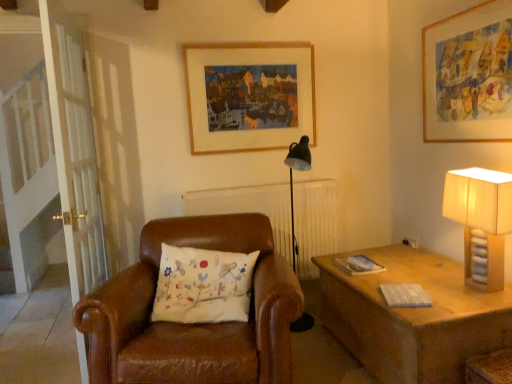
Question: Does wooden picture frame at upper right, the second picture frame viewed from the left, have a smaller size compared to beige fabric lampshade at right?

Choices:
 (A) no
 (B) yes

Answer: (B)

Question: Can you confirm if wooden picture frame at upper right, which ranks as the first picture frame in right-to-left order, is bigger than beige fabric lampshade at right?

Choices:
 (A) yes
 (B) no

Answer: (B)

Question: Is wooden picture frame at upper right, the second picture frame viewed from the left, thinner than beige fabric lampshade at right?

Choices:
 (A) no
 (B) yes

Answer: (B)

Question: Is wooden picture frame at upper right, which is counted as the first picture frame, starting from the front, completely or partially outside of beige fabric lampshade at right?

Choices:
 (A) yes
 (B) no

Answer: (A)

Question: Is the surface of wooden picture frame at upper right, which ranks as the first picture frame in right-to-left order, in direct contact with beige fabric lampshade at right?

Choices:
 (A) yes
 (B) no

Answer: (B)

Question: Could you tell me if wooden picture frame at upper right, the second picture frame positioned from the back, is turned towards beige fabric lampshade at right?

Choices:
 (A) no
 (B) yes

Answer: (A)

Question: Does beige fabric lampshade at right appear on the left side of white wooden screen door at left?

Choices:
 (A) yes
 (B) no

Answer: (B)

Question: Does beige fabric lampshade at right appear on the right side of white wooden screen door at left?

Choices:
 (A) no
 (B) yes

Answer: (B)

Question: Are beige fabric lampshade at right and white wooden screen door at left far apart?

Choices:
 (A) no
 (B) yes

Answer: (B)

Question: Would you say beige fabric lampshade at right contains white wooden screen door at left?

Choices:
 (A) yes
 (B) no

Answer: (B)

Question: From a real-world perspective, is beige fabric lampshade at right below white wooden screen door at left?

Choices:
 (A) yes
 (B) no

Answer: (A)

Question: Does beige fabric lampshade at right have a smaller size compared to white wooden screen door at left?

Choices:
 (A) no
 (B) yes

Answer: (B)

Question: Does beige fabric lampshade at right have a larger size compared to white embroidered pillow at center?

Choices:
 (A) no
 (B) yes

Answer: (A)